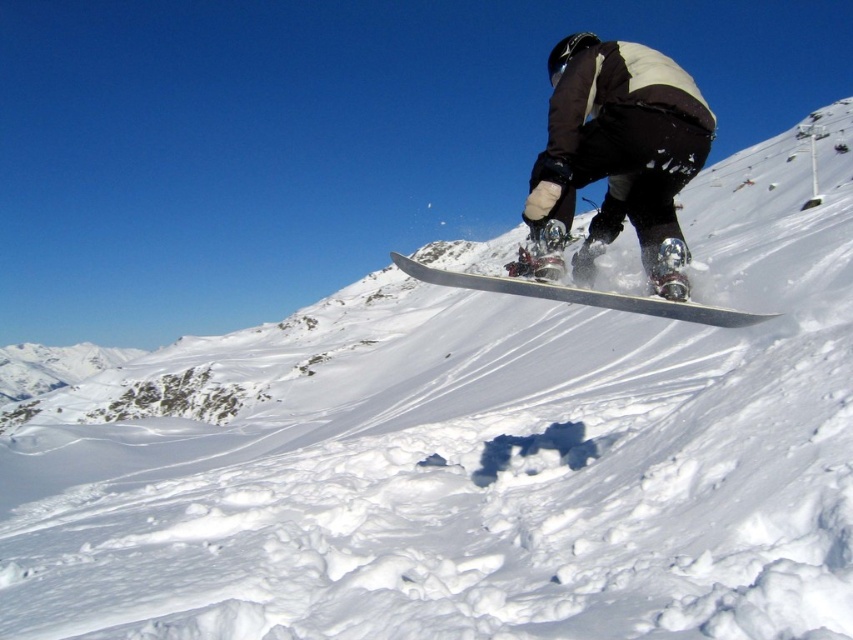
You are a safety inspector checking the equipment of the snowboarder in the image. You need to ensure that the distance between the black matte snowboarder at center and the silver metallic snowboard at center is within the recommended 3 meters for proper balance. Is the current distance compliant?

The distance between the black matte snowboarder at center and the silver metallic snowboard at center is 3.16 meters, which exceeds the recommended 3 meters. Therefore, the current distance is not compliant and may affect the snowboarder s balance.

You are a photographer trying to capture the snowboarder and their snowboard in a single shot. Given that your camera frame can only accommodate objects up to the size of the black matte snowboarder at center, will the white matte snowboard at center fit entirely within the frame?

The white matte snowboard at center has a larger size compared to the black matte snowboarder at center. Since the camera frame can only accommodate the size of the black matte snowboarder at center, the white matte snowboard at center will not fit entirely within the frame.